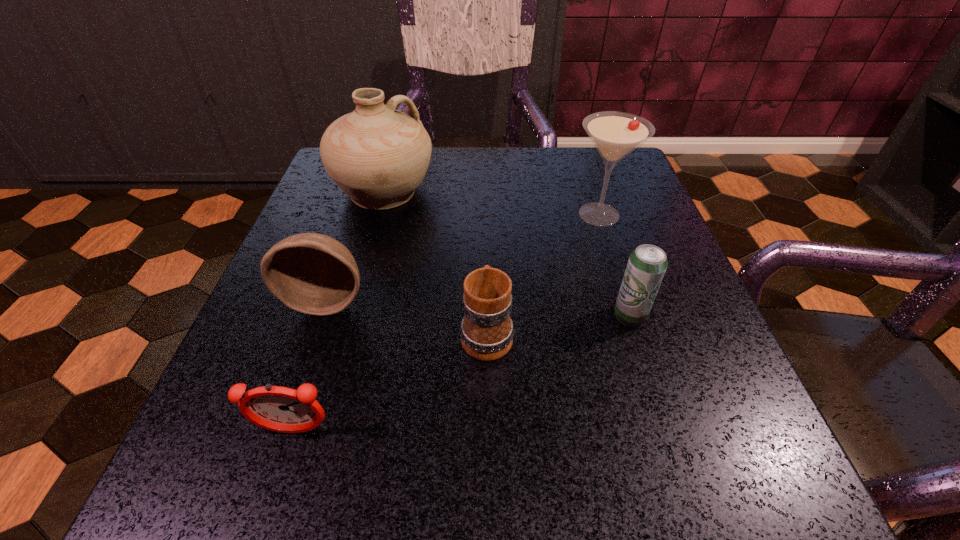
Find the location of `alarm clock at the left edge`. alarm clock at the left edge is located at coordinates (281, 409).

This screenshot has height=540, width=960. I want to click on martini situated at the right edge, so [615, 134].

I want to click on beer can at the right edge, so click(647, 264).

Where is `object that is at the far left corner`? The height and width of the screenshot is (540, 960). object that is at the far left corner is located at coordinates (378, 156).

Identify the location of object located at the near left corner. This screenshot has height=540, width=960. (281, 409).

In order to click on object present at the far right corner in this screenshot , I will do `click(615, 134)`.

Where is `vacant point at the far edge`? This screenshot has height=540, width=960. vacant point at the far edge is located at coordinates (531, 147).

Locate an element on the screen. Image resolution: width=960 pixels, height=540 pixels. free space at the near edge of the desktop is located at coordinates (491, 500).

In the image, there is a desktop. Identify the location of vacant space at the left edge. (221, 423).

In the image, there is a desktop. Identify the location of vacant space at the right edge. (683, 341).